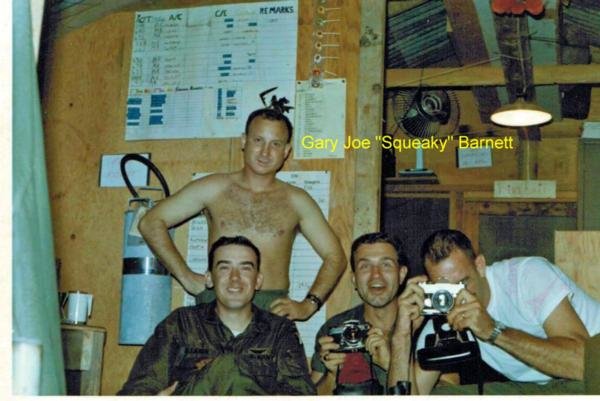
The image size is (600, 401). What are the coordinates of `wooden wall` in the screenshot? It's located at (113, 68), (93, 239).